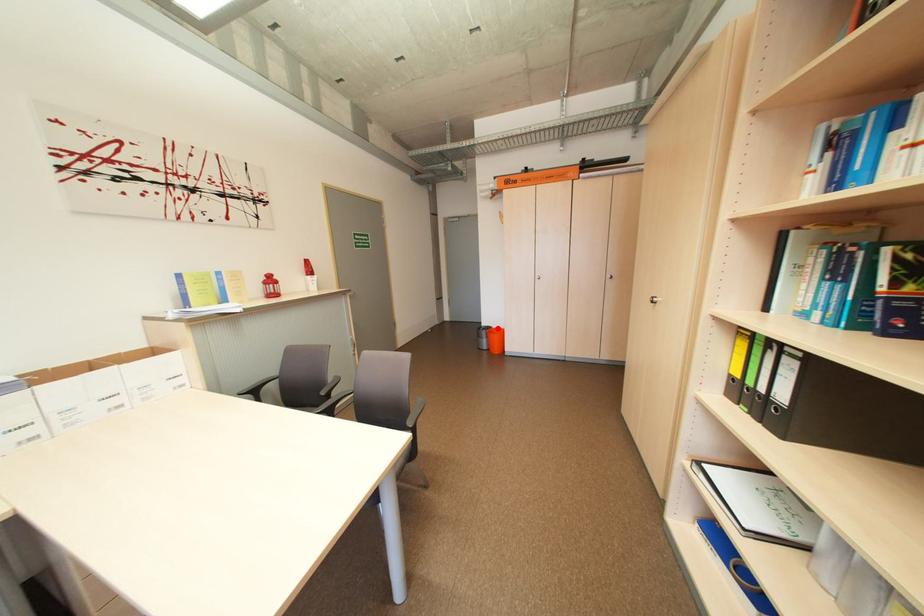
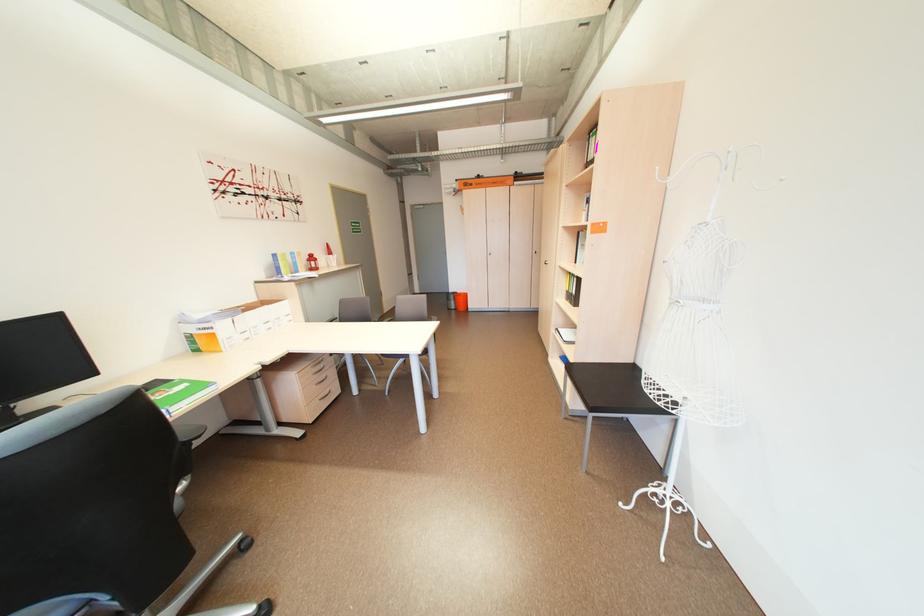
Question: A red point is marked in image1. In image2, is the corresponding 3D point closer to the camera or farther? Reply with the corresponding letter.

Choices:
 (A) The corresponding 3D point is closer.
 (B) The corresponding 3D point is farther.

Answer: (A)